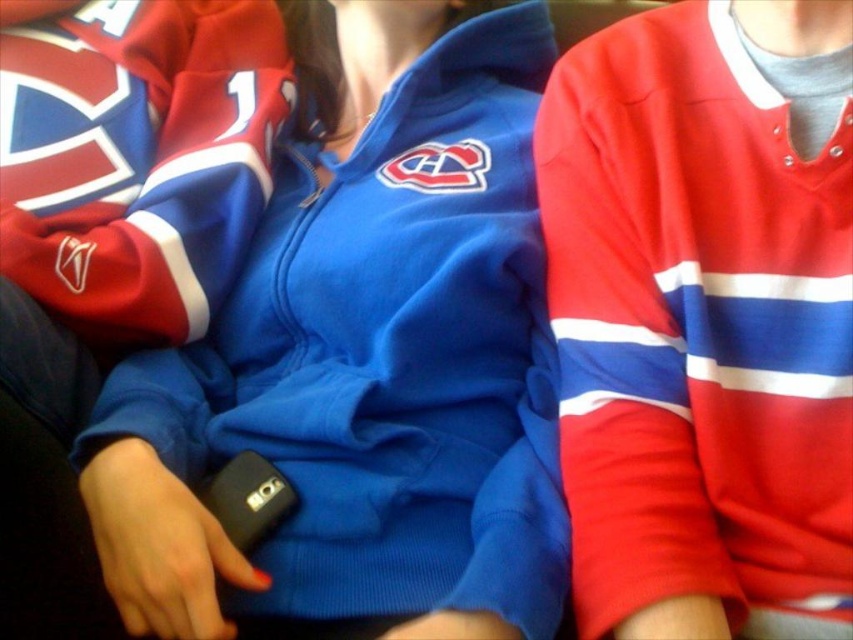
You are a photographer at the event and want to capture a clear photo of both the matte blue hoodie at center and the matte jersey at center. Considering their heights, which one is more likely to block the view of the other when standing behind them?

The matte blue hoodie at center is much taller as matte jersey at center, so it is more likely to block the view of the matte jersey at center when standing behind them.

You are a photographer trying to capture a candid shot of the matte jersey at center without blocking the view of the matte blue hoodie at center. Is it possible to position yourself in a way that allows you to see both subjects clearly?

The matte jersey at center is behind the matte blue hoodie at center, so positioning yourself in front of the matte blue hoodie at center would allow you to see both subjects clearly without obstruction.